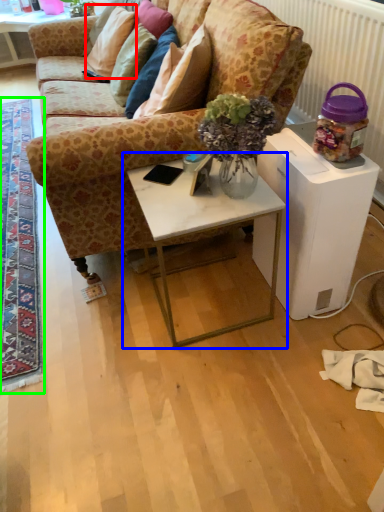
Question: Which is nearer to the pillow (highlighted by a red box)? table (highlighted by a blue box) or mat (highlighted by a green box).

Choices:
 (A) table
 (B) mat

Answer: (B)